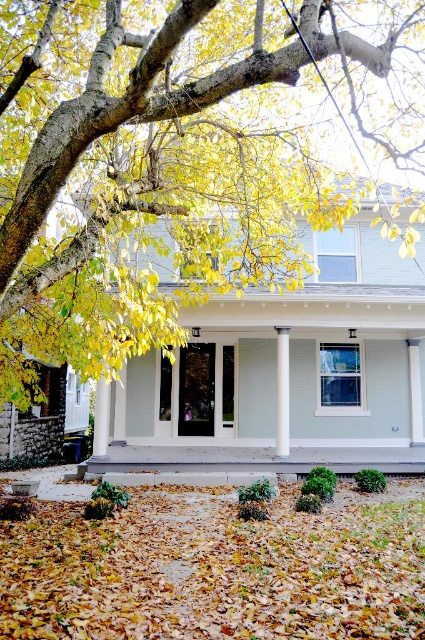
You are standing on the front porch of the house and want to walk to the point marked as point (280, 371). However, there is an obstacle at point (110, 310). Will you be able to see the obstacle before reaching your destination?

Yes, because point (110, 310) is in front of point (280, 371), so the obstacle at point (110, 310) will be visible before reaching the destination.

You are standing on the front porch of the house and looking towards the yellow leafy tree at upper left and the brown leaf litter at lower center. Which object appears narrower from your vantage point?

The yellow leafy tree at upper left appears narrower than the brown leaf litter at lower center because it is thinner.

You are a painter standing on the ground in front of the house. You want to paint both the yellow leafy tree at upper left and the white glossy column at center. Which object should you focus on first if you want to paint the wider one?

The yellow leafy tree at upper left might be wider than white glossy column at center, so you should focus on painting the yellow leafy tree at upper left first.